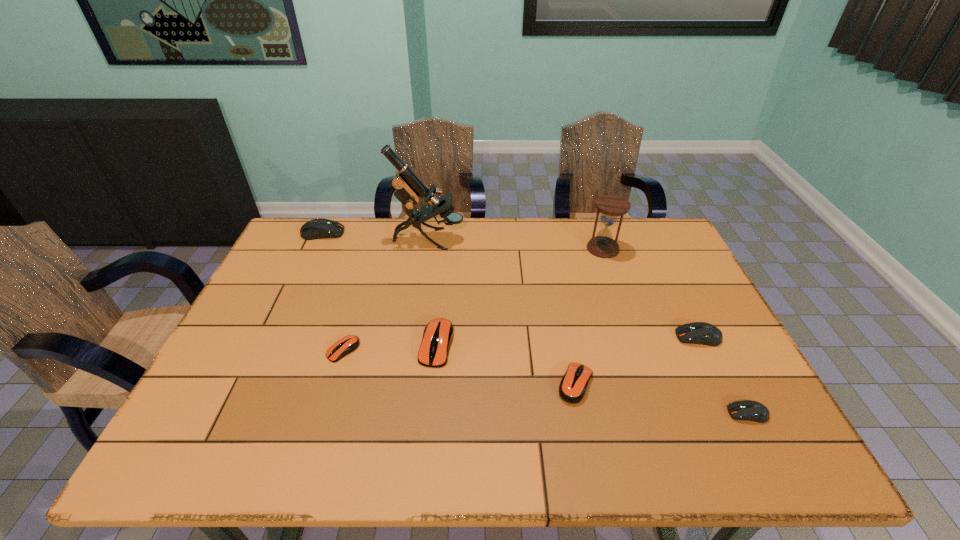
This screenshot has height=540, width=960. In order to click on dark computer equipment that stands as the second closest to the second orange computer mouse from right to left in this screenshot , I will do click(703, 333).

Identify which dark computer equipment is the nearest to the smallest dark computer equipment. Please provide its 2D coordinates. Your answer should be formatted as a tuple, i.e. [(x, y)], where the tuple contains the x and y coordinates of a point satisfying the conditions above.

[(703, 333)]

Locate which orange computer mouse is the closest to the farthest computer mouse. Please provide its 2D coordinates. Your answer should be formatted as a tuple, i.e. [(x, y)], where the tuple contains the x and y coordinates of a point satisfying the conditions above.

[(346, 345)]

Find the location of a particular element. the closest orange computer mouse to the nearest dark computer equipment is located at coordinates (573, 385).

You are a GUI agent. You are given a task and a screenshot of the screen. Output one action in this format:
    pyautogui.click(x=<x>, y=<y>)
    Task: Click on the free space that satisfies the following two spatial constraints: 1. on the button of the farthest dark computer equipment; 2. on the left side of the third computer mouse from right to left
    The image size is (960, 540).
    Given the screenshot: What is the action you would take?
    tap(253, 384)

What are the coordinates of `free space in the image that satisfies the following two spatial constraints: 1. through the eyepiece of the tallest object; 2. on the left side of the fourth computer mouse from right to left` in the screenshot? It's located at (414, 345).

Find the location of a particular element. Image resolution: width=960 pixels, height=540 pixels. vacant space that satisfies the following two spatial constraints: 1. on the back side of the leftmost orange computer mouse; 2. on the button of the tallest computer mouse is located at coordinates [x=378, y=233].

Image resolution: width=960 pixels, height=540 pixels. Find the location of `vacant space that satisfies the following two spatial constraints: 1. on the back side of the fourth computer mouse from left to right; 2. on the button of the farthest dark computer equipment`. vacant space that satisfies the following two spatial constraints: 1. on the back side of the fourth computer mouse from left to right; 2. on the button of the farthest dark computer equipment is located at coordinates (546, 233).

You are a GUI agent. You are given a task and a screenshot of the screen. Output one action in this format:
    pyautogui.click(x=<x>, y=<y>)
    Task: Click on the blank area in the image that satisfies the following two spatial constraints: 1. on the back side of the third computer mouse from left to right; 2. on the button of the biggest dark computer equipment
    Image resolution: width=960 pixels, height=540 pixels.
    Given the screenshot: What is the action you would take?
    447,233

The image size is (960, 540). I want to click on free location that satisfies the following two spatial constraints: 1. on the button of the farthest computer mouse; 2. on the right side of the hourglass, so click(x=316, y=248).